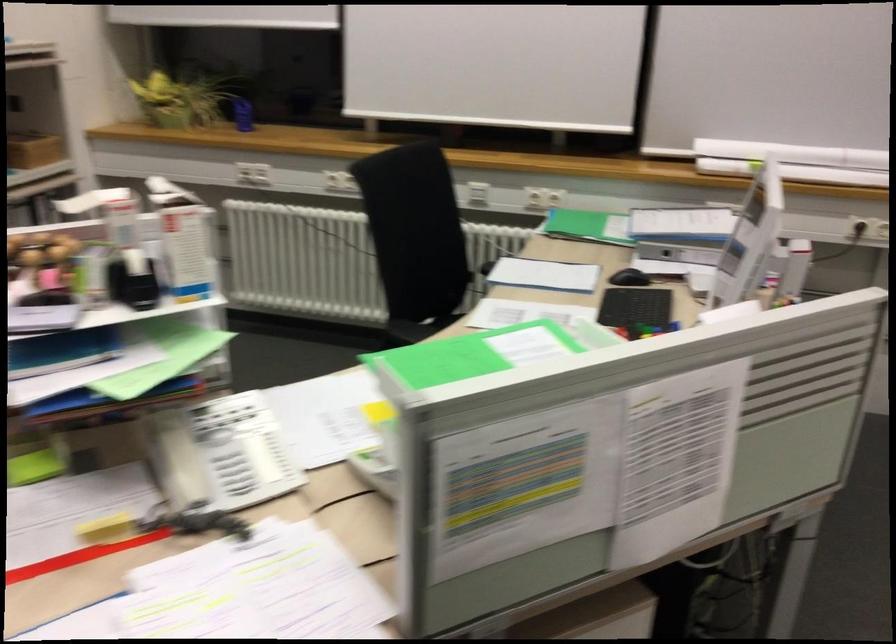
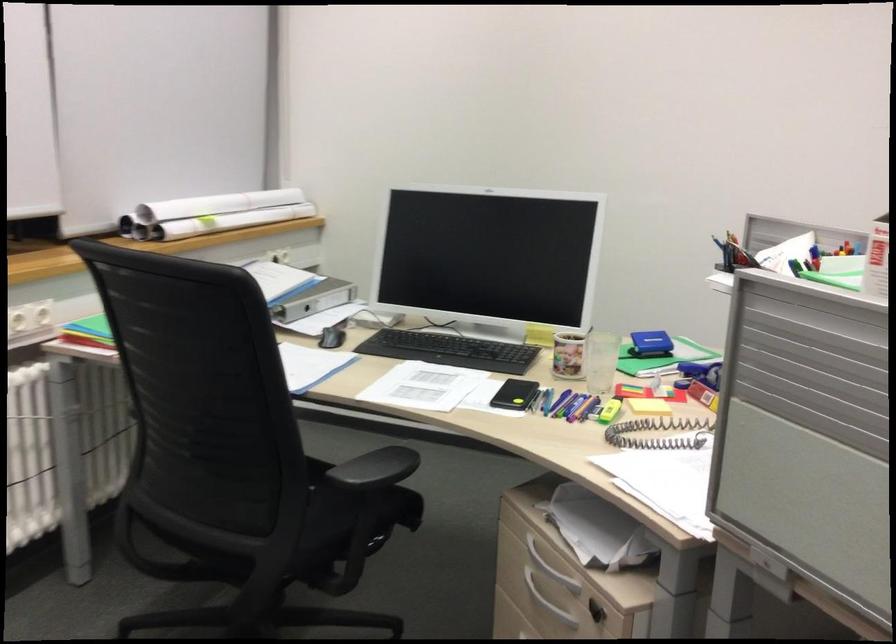
Find the pixel in the second image that matches the point at 777,155 in the first image.

(212, 214)